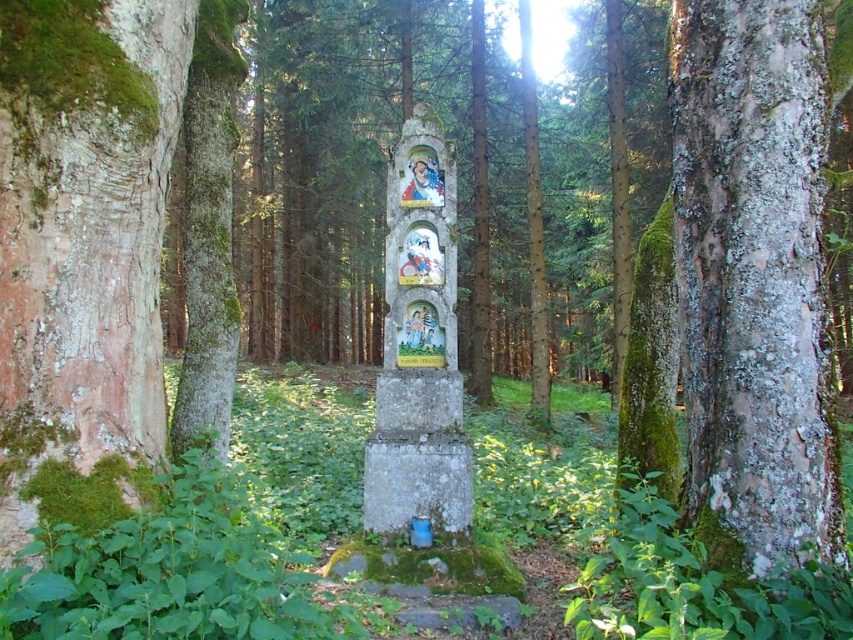
Question: Among these points, which one is farthest from the camera?

Choices:
 (A) (47, 356)
 (B) (788, 566)

Answer: (A)

Question: Does speckled bark tree trunk at right appear over stone statue at center?

Choices:
 (A) yes
 (B) no

Answer: (A)

Question: Which point is closer to the camera?

Choices:
 (A) (100, 156)
 (B) (444, 323)
 (C) (827, 131)

Answer: (A)

Question: Which point is farther to the camera?

Choices:
 (A) (91, 72)
 (B) (749, 49)
 (C) (393, 333)

Answer: (C)

Question: Can you confirm if speckled bark tree trunk at right is wider than stone statue at center?

Choices:
 (A) yes
 (B) no

Answer: (B)

Question: Does speckled bark tree trunk at right have a larger size compared to stone statue at center?

Choices:
 (A) yes
 (B) no

Answer: (B)